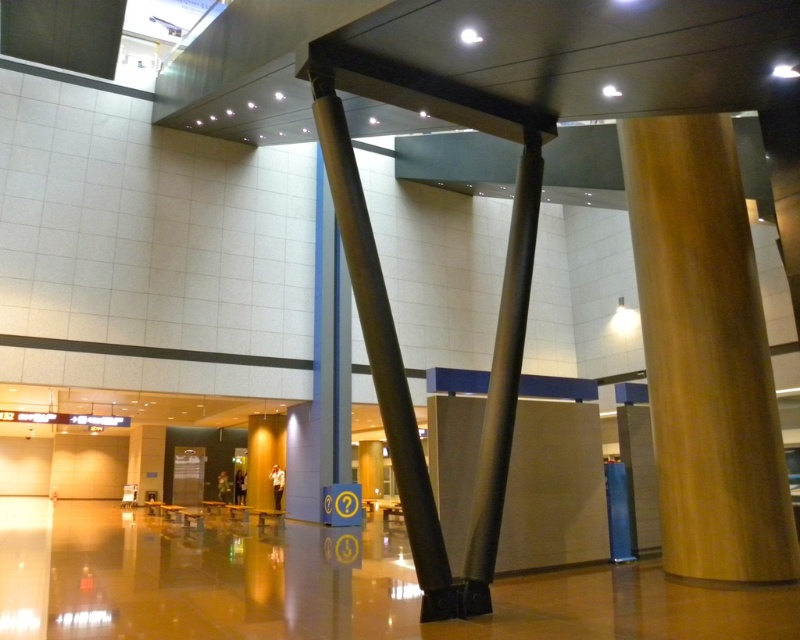
Which is below, gold polished column at center or satin gold pole at center?

gold polished column at center is below.

This screenshot has height=640, width=800. What do you see at coordinates (705, 355) in the screenshot? I see `gold polished column at center` at bounding box center [705, 355].

The width and height of the screenshot is (800, 640). Describe the element at coordinates (705, 355) in the screenshot. I see `gold polished column at center` at that location.

Where is `gold polished column at center`? This screenshot has height=640, width=800. gold polished column at center is located at coordinates (705, 355).

Which is above, metallic gray pole at center or satin gold pole at center?

satin gold pole at center is above.

Between point (400, 410) and point (512, 252), which one is positioned in front?

Point (400, 410) is more forward.

Find the location of a particular element. This screenshot has width=800, height=640. metallic gray pole at center is located at coordinates (384, 356).

Based on the photo, between gold polished column at center and metallic gray pole at center, which one has less height?

With less height is metallic gray pole at center.

Consider the image. Who is positioned more to the left, gold polished column at center or metallic gray pole at center?

metallic gray pole at center

Which is behind, point (730, 577) or point (356, 275)?

The point (730, 577) is behind.

This screenshot has width=800, height=640. I want to click on gold polished column at center, so click(705, 355).